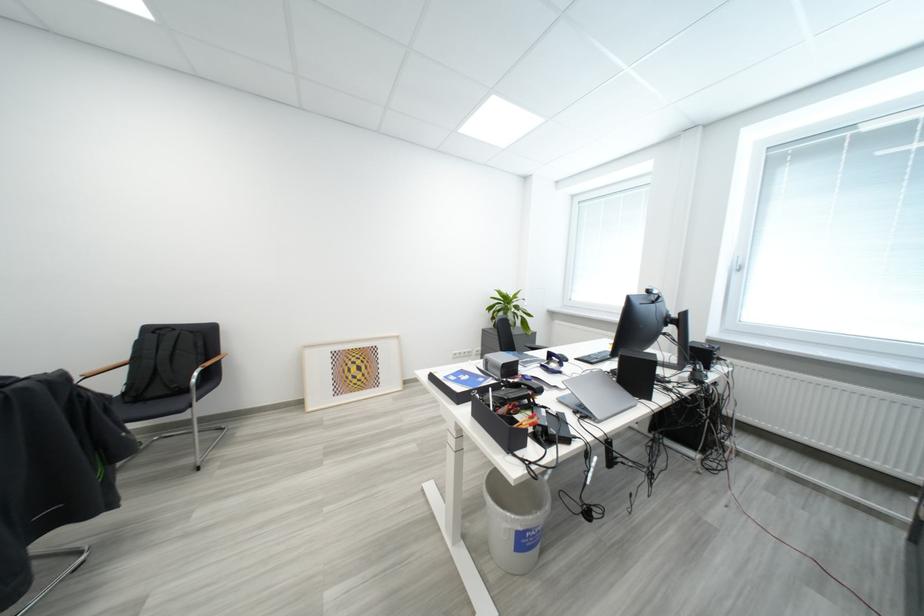
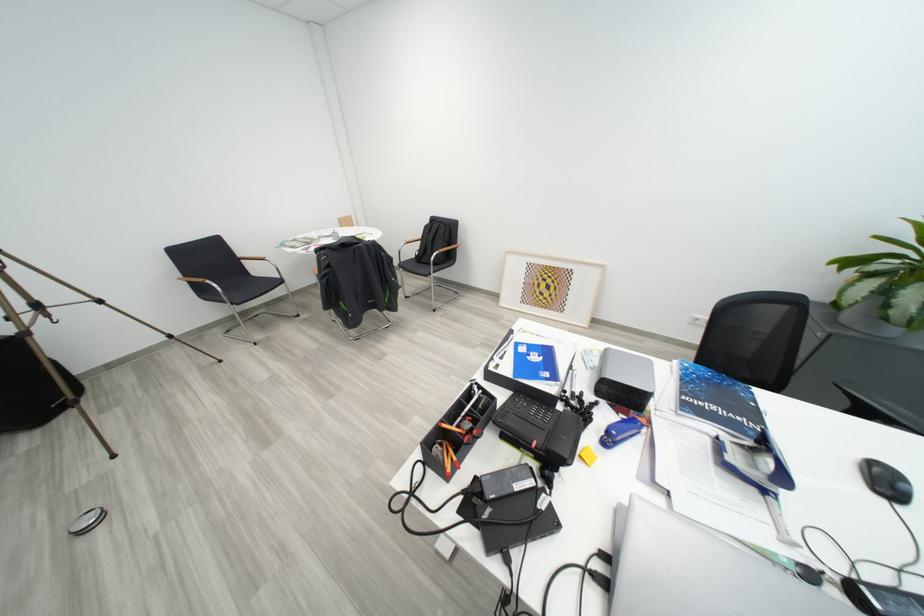
The images are taken continuously from a first-person perspective. In which direction is your viewpoint rotating?

The rotation direction of the camera is left-down.